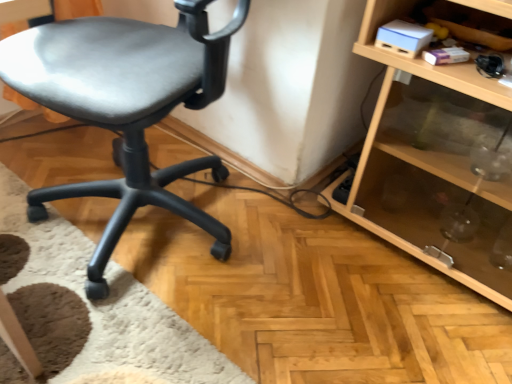
Question: Is transparent glass shelf at lower right surrounding matte black chair at left?

Choices:
 (A) no
 (B) yes

Answer: (A)

Question: Does transparent glass shelf at lower right turn towards matte black chair at left?

Choices:
 (A) no
 (B) yes

Answer: (A)

Question: Is there a large distance between transparent glass shelf at lower right and matte black chair at left?

Choices:
 (A) yes
 (B) no

Answer: (B)

Question: From the image's perspective, is transparent glass shelf at lower right on matte black chair at left?

Choices:
 (A) yes
 (B) no

Answer: (B)

Question: Is transparent glass shelf at lower right to the left of matte black chair at left from the viewer's perspective?

Choices:
 (A) yes
 (B) no

Answer: (B)

Question: Considering the relative sizes of transparent glass shelf at lower right and matte black chair at left in the image provided, is transparent glass shelf at lower right wider than matte black chair at left?

Choices:
 (A) yes
 (B) no

Answer: (B)

Question: Is matte black chair at left oriented towards transparent glass shelf at lower right?

Choices:
 (A) yes
 (B) no

Answer: (B)

Question: Considering the relative sizes of matte black chair at left and transparent glass shelf at lower right in the image provided, is matte black chair at left bigger than transparent glass shelf at lower right?

Choices:
 (A) yes
 (B) no

Answer: (A)

Question: Is the position of matte black chair at left more distant than that of transparent glass shelf at lower right?

Choices:
 (A) no
 (B) yes

Answer: (A)

Question: Can you confirm if matte black chair at left is taller than transparent glass shelf at lower right?

Choices:
 (A) yes
 (B) no

Answer: (A)

Question: Can you confirm if matte black chair at left is wider than transparent glass shelf at lower right?

Choices:
 (A) no
 (B) yes

Answer: (B)

Question: Is transparent glass shelf at lower right located within matte black chair at left?

Choices:
 (A) no
 (B) yes

Answer: (A)

Question: Relative to transparent glass shelf at lower right, is matte black chair at left in front or behind?

Choices:
 (A) behind
 (B) front

Answer: (B)